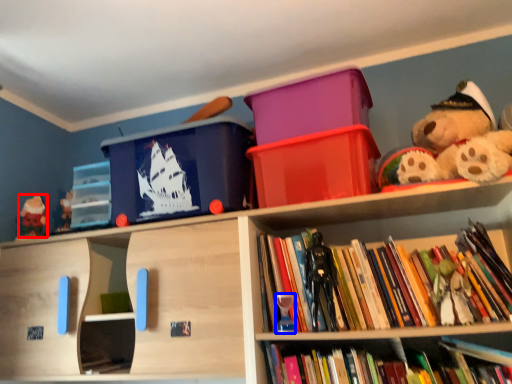
Question: Which point is closer to the camera, toy (highlighted by a red box) or toy (highlighted by a blue box)?

Choices:
 (A) toy
 (B) toy

Answer: (B)